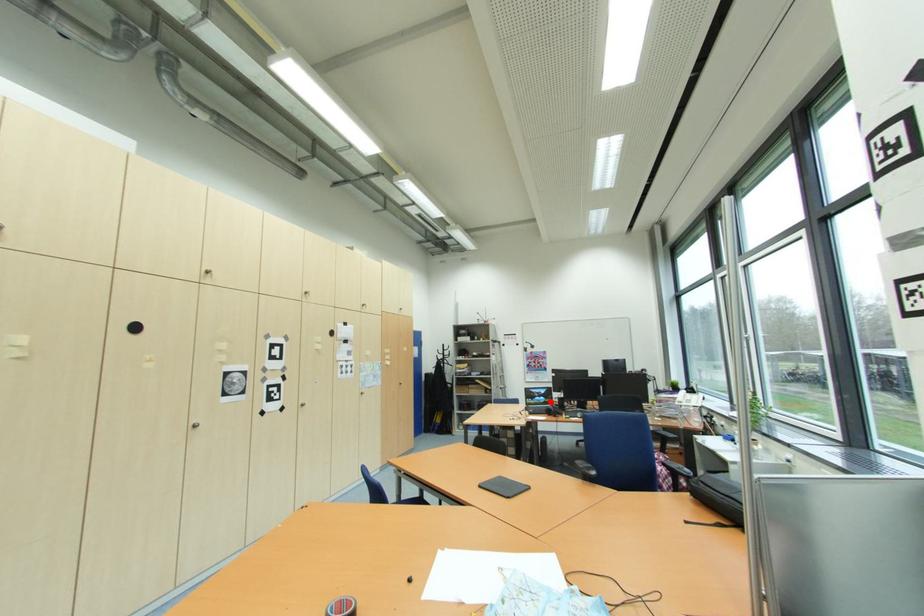
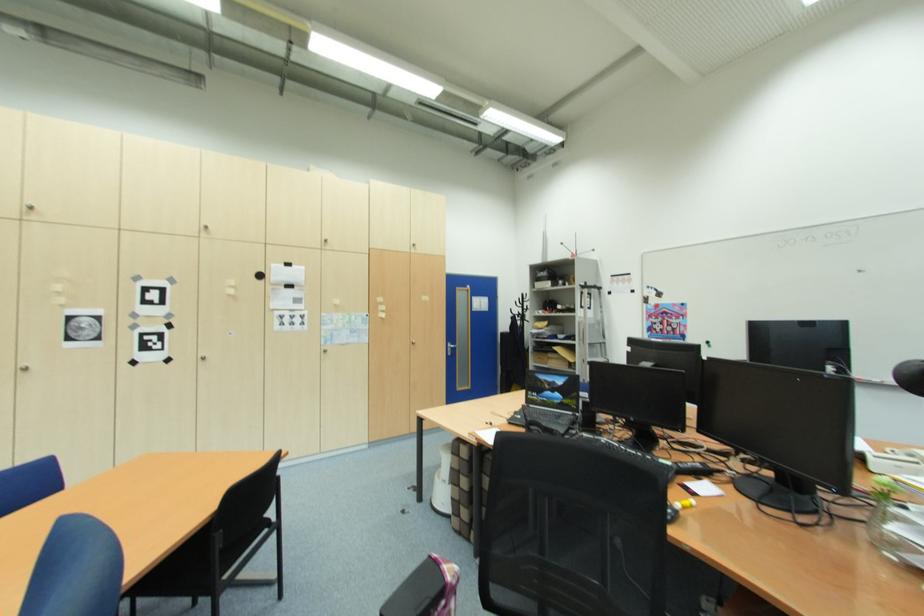
The point at the highlighted location is marked in the first image. Where is the corresponding point in the second image?

(569, 402)